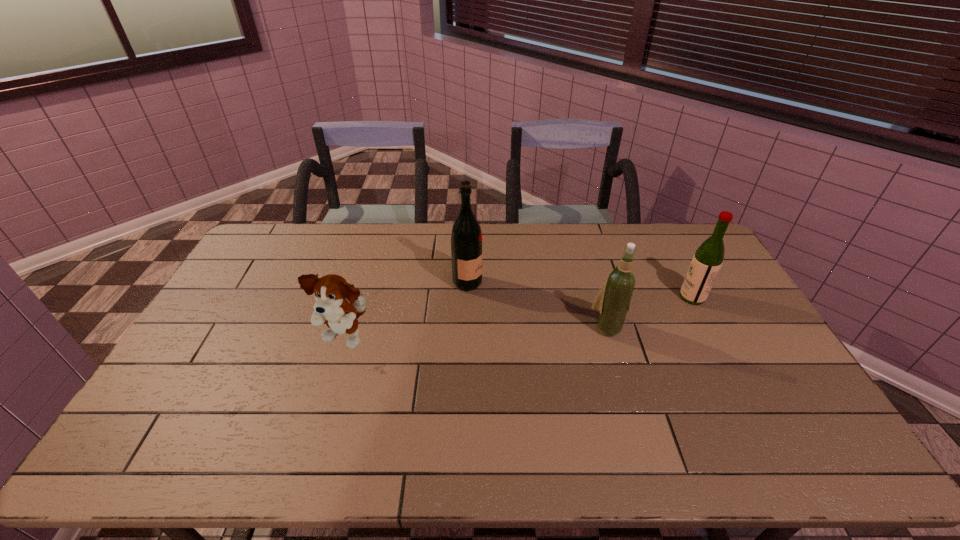
At what (x,y) coordinates should I click in order to perform the action: click on free area in between the left liquor and the rightmost object. Please return your answer as a coordinate pair (x, y). Image resolution: width=960 pixels, height=540 pixels. Looking at the image, I should click on (580, 290).

At what (x,y) coordinates should I click in order to perform the action: click on unoccupied area between the second object from right to left and the third object from right to left. Please return your answer as a coordinate pair (x, y). Image resolution: width=960 pixels, height=540 pixels. Looking at the image, I should click on (538, 305).

Find the location of a particular element. The height and width of the screenshot is (540, 960). free spot between the third object from left to right and the rightmost object is located at coordinates (650, 312).

The image size is (960, 540). In order to click on vacant area that lies between the wine bottle and the tallest object in this screenshot , I will do `click(538, 305)`.

Locate an element on the screen. Image resolution: width=960 pixels, height=540 pixels. free point between the third object from left to right and the leftmost object is located at coordinates (476, 333).

What are the coordinates of `vacant area that lies between the shortest object and the taller liquor` in the screenshot? It's located at (407, 310).

This screenshot has height=540, width=960. I want to click on vacant area between the rightmost object and the second object from left to right, so click(x=580, y=290).

The width and height of the screenshot is (960, 540). Identify the location of free space between the shorter liquor and the left liquor. (580, 290).

This screenshot has height=540, width=960. I want to click on free space between the leftmost object and the shorter liquor, so click(x=519, y=318).

Find the location of `the second closest object to the rightmost object`. the second closest object to the rightmost object is located at coordinates (466, 238).